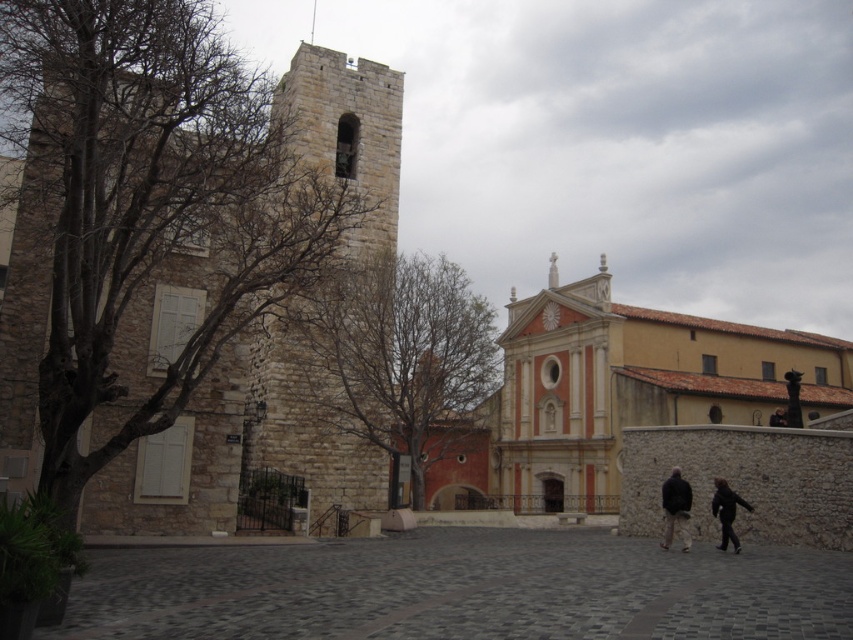
Question: Is dark brown leather jacket at lower right closer to camera compared to black matte jacket at lower right?

Choices:
 (A) no
 (B) yes

Answer: (A)

Question: Is stone tower at left bigger than black matte jacket at lower right?

Choices:
 (A) no
 (B) yes

Answer: (B)

Question: Which is farther from the stone tower at left?

Choices:
 (A) black leather jacket at lower right
 (B) dark brown leather jacket at lower right

Answer: (A)

Question: Considering the real-world distances, which object is farthest from the black leather jacket at lower right?

Choices:
 (A) stone textured bell tower at center
 (B) dark brown leather jacket at lower right
 (C) black matte jacket at lower right
 (D) stone tower at left

Answer: (D)

Question: Is black matte jacket at lower right to the left of black leather jacket at lower right from the viewer's perspective?

Choices:
 (A) no
 (B) yes

Answer: (B)

Question: Based on their relative distances, which object is nearer to the stone textured bell tower at center?

Choices:
 (A) black matte jacket at lower right
 (B) black leather jacket at lower right

Answer: (A)